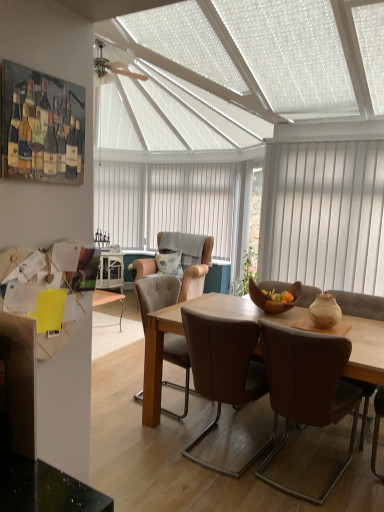
Find the location of `leather armchair at center, which is counted as the fourth chair, starting from the front`. leather armchair at center, which is counted as the fourth chair, starting from the front is located at coordinates (196, 273).

Describe the element at coordinates (183, 332) in the screenshot. I see `wooden table at center` at that location.

The image size is (384, 512). In order to click on brown leather chair at center, acting as the 3th chair starting from the back in this screenshot , I will do `click(224, 370)`.

The height and width of the screenshot is (512, 384). What do you see at coordinates (170, 263) in the screenshot?
I see `fluffy fabric pillow at center` at bounding box center [170, 263].

What are the coordinates of `brown leather chair at center, the 2th chair viewed from the back` in the screenshot? It's located at (156, 294).

Where is `leather armchair at center, which is counted as the fourth chair, starting from the front`? The width and height of the screenshot is (384, 512). leather armchair at center, which is counted as the fourth chair, starting from the front is located at coordinates (196, 273).

Can you see matte beige vase at right touching white vertical blinds at center?

No, matte beige vase at right is not beside white vertical blinds at center.

Does matte beige vase at right turn towards white vertical blinds at center?

No, matte beige vase at right is not oriented towards white vertical blinds at center.

Is matte beige vase at right located outside white vertical blinds at center?

Yes, matte beige vase at right is located beyond the bounds of white vertical blinds at center.

In order to click on window above the matte beige vase at right (from the image's perspective) in this screenshot , I will do `click(165, 202)`.

Considering the relative positions of leather armchair at center, arranged as the 1th chair when viewed from the back, and wooden bowl at center in the image provided, is leather armchair at center, arranged as the 1th chair when viewed from the back, to the left of wooden bowl at center from the viewer's perspective?

Yes, leather armchair at center, arranged as the 1th chair when viewed from the back, is to the left of wooden bowl at center.

From the image's perspective, relative to wooden bowl at center, is leather armchair at center, arranged as the 1th chair when viewed from the back, above or below?

leather armchair at center, arranged as the 1th chair when viewed from the back, is above wooden bowl at center.

Which of these two, leather armchair at center, arranged as the 1th chair when viewed from the back, or wooden bowl at center, is bigger?

leather armchair at center, arranged as the 1th chair when viewed from the back.

What's the angular difference between leather armchair at center, which is counted as the fourth chair, starting from the front, and wooden bowl at center's facing directions?

The angular difference between leather armchair at center, which is counted as the fourth chair, starting from the front, and wooden bowl at center is 1.65 degrees.

In the scene shown: Which of these two, brown leather chair at center, acting as the 3th chair starting from the back, or fluffy fabric pillow at center, is bigger?

brown leather chair at center, acting as the 3th chair starting from the back, is bigger.

Could you tell me if brown leather chair at center, acting as the 3th chair starting from the back, is turned towards fluffy fabric pillow at center?

No, brown leather chair at center, acting as the 3th chair starting from the back, is not oriented towards fluffy fabric pillow at center.

Is brown leather chair at center, the 2th chair positioned from the front, spatially inside fluffy fabric pillow at center, or outside of it?

brown leather chair at center, the 2th chair positioned from the front, is not inside fluffy fabric pillow at center, it's outside.

Based on the photo, is fluffy fabric pillow at center spatially inside white glossy table at center, or outside of it?

fluffy fabric pillow at center is outside white glossy table at center.

Does fluffy fabric pillow at center have a smaller size compared to white glossy table at center?

Correct, fluffy fabric pillow at center occupies less space than white glossy table at center.

Based on the photo, what's the angular difference between fluffy fabric pillow at center and white glossy table at center's facing directions?

There is a 29.9-degree angle between the facing directions of fluffy fabric pillow at center and white glossy table at center.

Could you tell me if brown leather chair at center, the 2th chair positioned from the front, is facing brown leather chair at center, the fourth chair in the back-to-front sequence?

No, brown leather chair at center, the 2th chair positioned from the front, is not oriented towards brown leather chair at center, the fourth chair in the back-to-front sequence.

From a real-world perspective, which is physically below, brown leather chair at center, acting as the 3th chair starting from the back, or brown leather chair at center, positioned as the 1th chair in front-to-back order?

brown leather chair at center, positioned as the 1th chair in front-to-back order.

Find the location of a particular element. Image resolution: width=384 pixels, height=512 pixels. the 1st chair behind the brown leather chair at center, the fourth chair in the back-to-front sequence, starting your count from the anchor is located at coordinates (224, 370).

Is brown leather chair at center, the 2th chair positioned from the front, positioned before brown leather chair at center, the fourth chair in the back-to-front sequence?

No, it is not.

Is white vertical blinds at center directly adjacent to leather armchair at center, which is counted as the fourth chair, starting from the front?

white vertical blinds at center and leather armchair at center, which is counted as the fourth chair, starting from the front, are not in contact.

From the image's perspective, which is above, white vertical blinds at center or leather armchair at center, which is counted as the fourth chair, starting from the front?

white vertical blinds at center appears higher in the image.

From the image's perspective, is fluffy fabric pillow at center above or below matte beige vase at right?

fluffy fabric pillow at center is above matte beige vase at right.

From a real-world perspective, relative to matte beige vase at right, is fluffy fabric pillow at center vertically above or below?

fluffy fabric pillow at center is situated lower than matte beige vase at right in the real world.

Could you tell me if fluffy fabric pillow at center is turned towards matte beige vase at right?

No, fluffy fabric pillow at center does not turn towards matte beige vase at right.

In order to click on vase that appears on the right of white vertical blinds at center in this screenshot , I will do `click(325, 311)`.

Where is `chair above the wooden bowl at center (from the image's perspective)`? chair above the wooden bowl at center (from the image's perspective) is located at coordinates (196, 273).

Looking at the image, which one is located closer to brown leather chair at center, which is counted as the 3th chair, starting from the front, white glossy table at center or matte beige vase at right?

matte beige vase at right.

Based on their spatial positions, is brown leather chair at center, which is counted as the 3th chair, starting from the front, or wooden bowl at center further from white vertical blinds at center?

wooden bowl at center is positioned further to the anchor white vertical blinds at center.

Considering their positions, is matte beige vase at right positioned closer to fluffy fabric pillow at center than brown leather chair at center, positioned as the 1th chair in front-to-back order?

Based on the image, matte beige vase at right appears to be nearer to fluffy fabric pillow at center.

Considering their positions, is wooden bowl at center positioned closer to white vertical blinds at center than leather armchair at center, arranged as the 1th chair when viewed from the back?

Based on the image, leather armchair at center, arranged as the 1th chair when viewed from the back, appears to be nearer to white vertical blinds at center.

When comparing their distances from brown leather chair at center, the 2th chair viewed from the back, does white glossy table at center or brown leather chair at center, the fourth chair in the back-to-front sequence, seem closer?

brown leather chair at center, the fourth chair in the back-to-front sequence, is closer to brown leather chair at center, the 2th chair viewed from the back.

Considering their positions, is brown leather chair at center, positioned as the 1th chair in front-to-back order, positioned closer to fluffy fabric pillow at center than white vertical blinds at center?

Among the two, white vertical blinds at center is located nearer to fluffy fabric pillow at center.

Which object lies nearer to the anchor point brown leather chair at center, acting as the 3th chair starting from the back, white wood blinds at right or fluffy fabric pillow at center?

white wood blinds at right lies closer to brown leather chair at center, acting as the 3th chair starting from the back, than the other object.

Looking at the image, which one is located closer to white wood blinds at right, brown leather chair at center, the 2th chair positioned from the front, or fluffy fabric pillow at center?

Among the two, brown leather chair at center, the 2th chair positioned from the front, is located nearer to white wood blinds at right.

The height and width of the screenshot is (512, 384). Identify the location of kitchen & dining room table between brown leather chair at center, the 2th chair viewed from the back, and white wood blinds at right. (183, 332).

Identify the location of bowl positioned between wooden table at center and leather armchair at center, which is counted as the fourth chair, starting from the front, from near to far. (272, 300).

The height and width of the screenshot is (512, 384). Find the location of `pillow between matte beige vase at right and white glossy table at center in the front-back direction`. pillow between matte beige vase at right and white glossy table at center in the front-back direction is located at coordinates (170, 263).

Image resolution: width=384 pixels, height=512 pixels. I want to click on kitchen & dining room table between brown leather chair at center, positioned as the 1th chair in front-to-back order, and white vertical blinds at center in the front-back direction, so click(x=183, y=332).